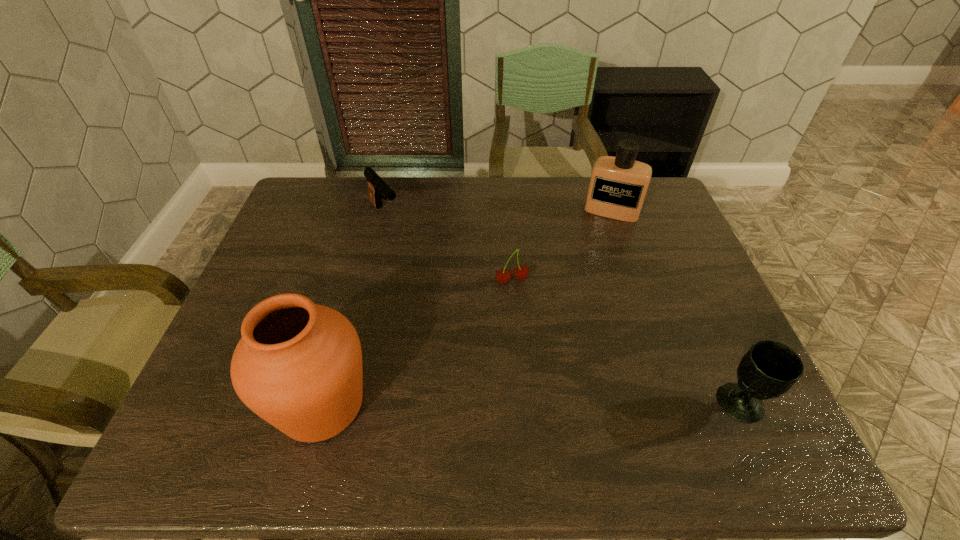
The image size is (960, 540). Identify the location of chalice that is positioned at the near edge. (769, 369).

At what (x,y) coordinates should I click in order to perform the action: click on object that is at the left edge. Please return your answer as a coordinate pair (x, y). The image size is (960, 540). Looking at the image, I should click on (298, 365).

This screenshot has height=540, width=960. I want to click on chalice positioned at the right edge, so click(769, 369).

Identify the location of perfume located at the right edge. (618, 185).

The height and width of the screenshot is (540, 960). I want to click on object located in the near left corner section of the desktop, so click(x=298, y=365).

The height and width of the screenshot is (540, 960). In order to click on object that is at the far right corner in this screenshot , I will do `click(618, 185)`.

Identify the location of object that is at the near right corner. The height and width of the screenshot is (540, 960). (769, 369).

I want to click on vacant space at the far edge of the desktop, so click(x=538, y=185).

Image resolution: width=960 pixels, height=540 pixels. I want to click on free space at the near edge of the desktop, so click(608, 396).

In the image, there is a desktop. In order to click on free space at the right edge in this screenshot , I will do `click(660, 258)`.